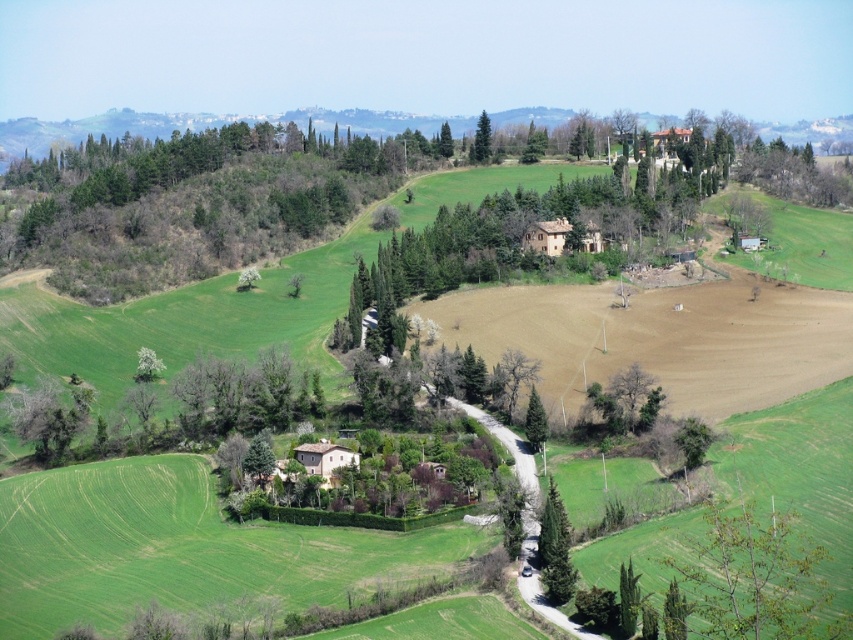
You are a landscape architect planning to plant a new tree in this area. You have two options for locations based on existing trees. The first option is near the green leafy tree at lower right, and the second is near the green leafy tree at upper center. Considering the spacing between trees, which location would allow for more room for the new tree to grow?

The green leafy tree at lower right might be wider than the green leafy tree at upper center, so planting near the green leafy tree at lower right would provide more space for the new tree to grow.

You are a landscape architect designing a new garden and want to place two green leafy trees in your design. You have the green leafy tree at lower left and the green leafy tree at upper center. Which tree should you choose if you want a taller tree for the center of the garden?

The green leafy tree at upper center is taller than the green leafy tree at lower left, so you should choose the green leafy tree at upper center for the center of the garden.

You are a landscape architect designing a new garden. You have two green leafy trees to place in your design. The green leafy tree at lower left and the green leafy tree at upper center. Which tree should you choose if you want a larger tree for the central focal point?

The green leafy tree at upper center is larger, so it would be suitable for the central focal point.